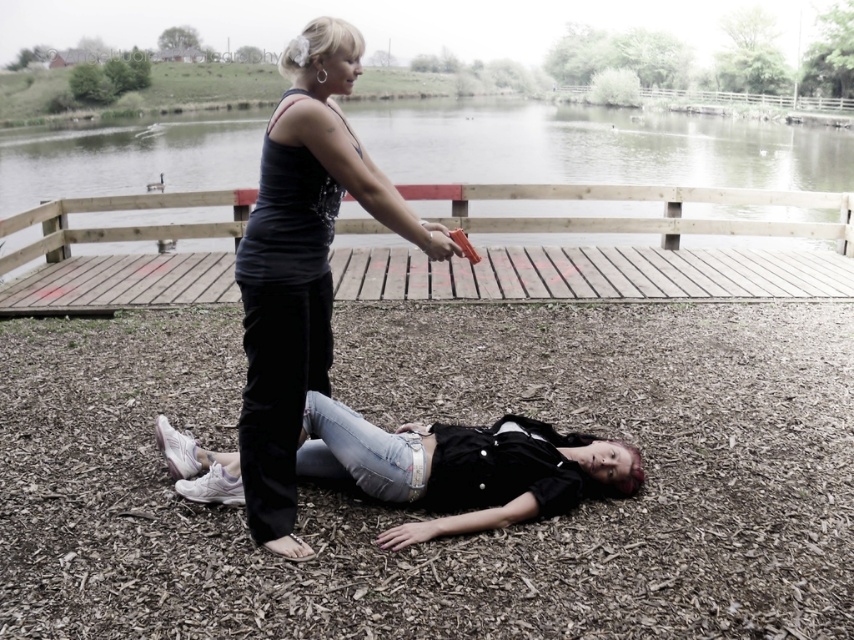
Between clear water at dock center and matte black tank top at center, which one is positioned higher?

Positioned higher is clear water at dock center.

Locate an element on the screen. Image resolution: width=854 pixels, height=640 pixels. clear water at dock center is located at coordinates (595, 147).

Identify the location of clear water at dock center. This screenshot has height=640, width=854. (595, 147).

I want to click on clear water at dock center, so click(595, 147).

Does point (381, 266) come in front of point (199, 481)?

No, (381, 266) is further to viewer.

Is wooden dock at center taller than denim jeans at lower center?

Incorrect, wooden dock at center's height is not larger of denim jeans at lower center's.

Is point (722, 276) farther from camera compared to point (159, 424)?

Yes, point (722, 276) is farther from viewer.

At what (x,y) coordinates should I click in order to perform the action: click on wooden dock at center. Please return your answer as a coordinate pair (x, y). The width and height of the screenshot is (854, 640). Looking at the image, I should click on [x=610, y=252].

Does matte black tank top at center come behind denim jeans at lower center?

No, it is not.

This screenshot has height=640, width=854. I want to click on matte black tank top at center, so click(302, 266).